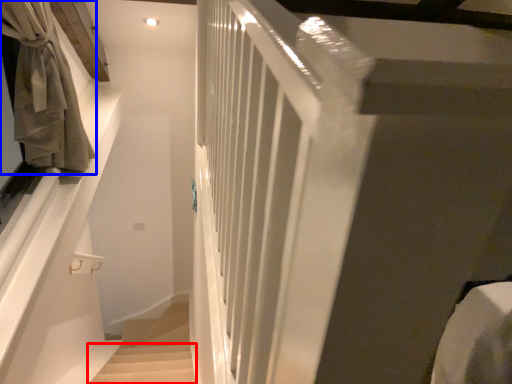
Question: Which object is further to the camera taking this photo, stairs (highlighted by a red box) or curtain (highlighted by a blue box)?

Choices:
 (A) stairs
 (B) curtain

Answer: (A)